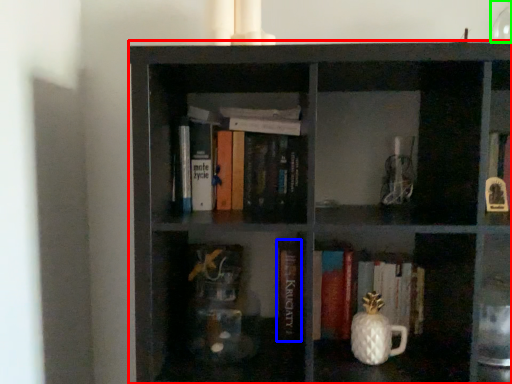
Question: Which object is the closest to the shelf (highlighted by a red box)? Choose among these: book (highlighted by a blue box) or glass vase (highlighted by a green box).

Choices:
 (A) book
 (B) glass vase

Answer: (A)